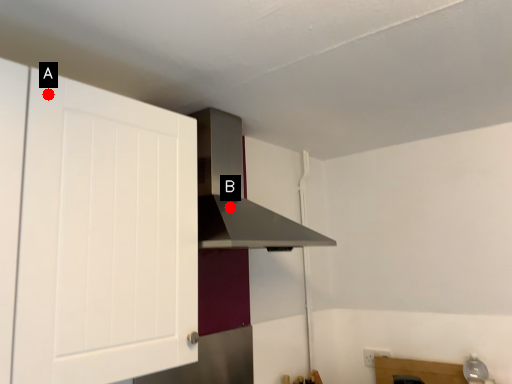
Question: Two points are circled on the image, labeled by A and B beside each circle. Which point appears closest to the camera in this image?

Choices:
 (A) A is closer
 (B) B is closer

Answer: (A)